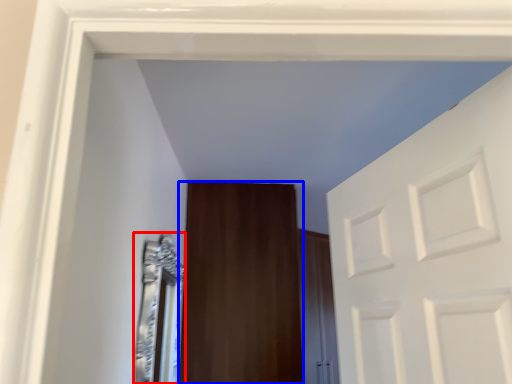
Question: Among these objects, which one is farthest to the camera, mirror (highlighted by a red box) or door (highlighted by a blue box)?

Choices:
 (A) mirror
 (B) door

Answer: (B)